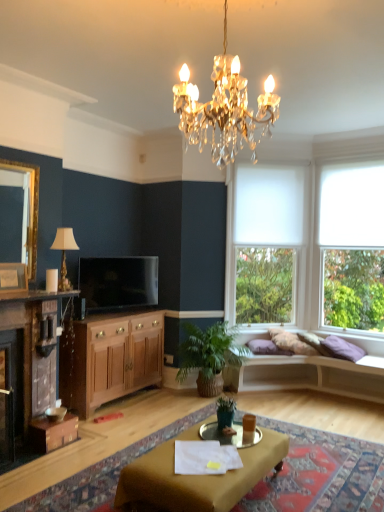
At what (x,y) coordinates should I click in order to perform the action: click on matte gold picture frame at left. Please return your answer as a coordinate pair (x, y). Image resolution: width=384 pixels, height=512 pixels. Looking at the image, I should click on (13, 278).

The image size is (384, 512). Describe the element at coordinates (268, 221) in the screenshot. I see `white roller blind at right, the 1th window positioned from the left` at that location.

From the picture: In order to face wooden cabinet at lower left, should I rotate leftwards or rightwards?

To face it directly, rotate left by 10.396 degrees.

What do you see at coordinates (112, 359) in the screenshot?
I see `wooden cabinet at lower left` at bounding box center [112, 359].

At what (x,y) coordinates should I click in order to perform the action: click on transparent glass window at right, placed as the first window when sorted from right to left. Please return your answer as a coordinate pair (x, y). Image resolution: width=384 pixels, height=512 pixels. Looking at the image, I should click on point(353,246).

Find the location of a particular element. The image size is (384, 512). matte gold picture frame at left is located at coordinates (13, 278).

Where is `window that is the 2nd one when counting rightward from the clear glass tray at center`? This screenshot has width=384, height=512. window that is the 2nd one when counting rightward from the clear glass tray at center is located at coordinates (353, 246).

Considering the positions of point (258, 434) and point (330, 207), is point (258, 434) closer or farther from the camera than point (330, 207)?

Point (258, 434) is positioned closer to the camera compared to point (330, 207).

Is clear glass tray at center facing away from transparent glass window at right, which is the second window in left-to-right order?

That's not correct — clear glass tray at center is not looking away from transparent glass window at right, which is the second window in left-to-right order.

Is clear glass tray at center with transparent glass window at right, which is the second window in left-to-right order?

No, clear glass tray at center is not with transparent glass window at right, which is the second window in left-to-right order.

In terms of height, does white roller blind at right, the 1th window positioned from the left, look taller or shorter compared to matte black mantel at left?

In the image, white roller blind at right, the 1th window positioned from the left, appears to be taller than matte black mantel at left.

Is white roller blind at right, the 1th window positioned from the left, positioned beyond the bounds of matte black mantel at left?

Yes, white roller blind at right, the 1th window positioned from the left, is located beyond the bounds of matte black mantel at left.

From a real-world perspective, which is physically below, white roller blind at right, the second window in the right-to-left sequence, or matte black mantel at left?

From a 3D spatial view, matte black mantel at left is below.

Can you confirm if white roller blind at right, the 1th window positioned from the left, is bigger than matte black mantel at left?

Correct, white roller blind at right, the 1th window positioned from the left, is larger in size than matte black mantel at left.

In the scene shown: Is matte gold picture frame at left spatially inside matte brown desk at center, or outside of it?

matte gold picture frame at left is spatially situated outside matte brown desk at center.

Does matte gold picture frame at left have a lesser height compared to matte brown desk at center?

No, matte gold picture frame at left is not shorter than matte brown desk at center.

Considering the positions of objects matte gold picture frame at left and matte brown desk at center in the image provided, who is behind, matte gold picture frame at left or matte brown desk at center?

matte gold picture frame at left.

From the image's perspective, is matte gold picture frame at left below matte brown desk at center?

No, from the image's perspective, matte gold picture frame at left is not beneath matte brown desk at center.

From the image's perspective, is matte gold picture frame at left located above green woven basket at lower center, which ranks as the second houseplant in front-to-back order?

Yes, from the image's perspective, matte gold picture frame at left is over green woven basket at lower center, which ranks as the second houseplant in front-to-back order.

Considering the sizes of objects matte gold picture frame at left and green woven basket at lower center, marked as the 1th houseplant in a back-to-front arrangement, in the image provided, who is shorter, matte gold picture frame at left or green woven basket at lower center, marked as the 1th houseplant in a back-to-front arrangement,?

matte gold picture frame at left.

Is matte gold picture frame at left positioned behind green woven basket at lower center, which ranks as the second houseplant in front-to-back order?

No, matte gold picture frame at left is closer to the camera.

The width and height of the screenshot is (384, 512). I want to click on pillow lying behind the green woven basket at lower center, marked as the 1th houseplant in a back-to-front arrangement, so click(342, 348).

From a real-world perspective, which object rests below the other?

In real-world perspective, green woven basket at lower center, marked as the 1th houseplant in a back-to-front arrangement, is lower.

Is purple velvet pillow at right aimed at green woven basket at lower center, which ranks as the second houseplant in front-to-back order?

No, purple velvet pillow at right is not oriented towards green woven basket at lower center, which ranks as the second houseplant in front-to-back order.

Which object is further away from the camera, purple velvet pillow at right or green woven basket at lower center, which ranks as the second houseplant in front-to-back order?

purple velvet pillow at right is further from the camera.

Considering the sizes of objects purple velvet pillow at right and matte brown desk at center in the image provided, who is bigger, purple velvet pillow at right or matte brown desk at center?

matte brown desk at center is bigger.

Considering the positions of objects purple velvet pillow at right and matte brown desk at center in the image provided, who is in front, purple velvet pillow at right or matte brown desk at center?

matte brown desk at center.

What's the angular difference between purple velvet pillow at right and matte brown desk at center's facing directions?

90.4 degrees separate the facing orientations of purple velvet pillow at right and matte brown desk at center.

Does point (40, 293) come behind point (255, 470)?

Yes, point (40, 293) is behind point (255, 470).

From a real-world perspective, who is located higher, matte black mantel at left or matte brown desk at center?

From a 3D spatial view, matte black mantel at left is above.

Consider the image. Can we say matte black mantel at left lies outside matte brown desk at center?

Yes, matte black mantel at left is located beyond the bounds of matte brown desk at center.

Is matte black mantel at left to the right of matte brown desk at center from the viewer's perspective?

Incorrect, matte black mantel at left is not on the right side of matte brown desk at center.

Identify the location of glass table lying below the transparent glass window at right, which is the second window in left-to-right order (from the image's perspective). The image size is (384, 512). (229, 435).

The image size is (384, 512). What are the coordinates of `the 1st window counting from the right side of the matte black mantel at left` in the screenshot? It's located at (268, 221).

Consider the image. Estimate the real-world distances between objects in this image. Which object is further from white wood studio couch at lower right, wooden cabinet at lower left or transparent glass window at right, placed as the first window when sorted from right to left?

Based on the image, transparent glass window at right, placed as the first window when sorted from right to left, appears to be further to white wood studio couch at lower right.

Estimate the real-world distances between objects in this image. Which object is closer to green woven basket at lower center, marked as the 1th houseplant in a back-to-front arrangement, gold-framed mirror at upper left or flat screen tv at center?

flat screen tv at center is positioned closer to the anchor green woven basket at lower center, marked as the 1th houseplant in a back-to-front arrangement.

Estimate the real-world distances between objects in this image. Which object is further from matte black mantel at left, matte brown desk at center or green woven basket at lower center, which ranks as the second houseplant in front-to-back order?

matte brown desk at center lies further to matte black mantel at left than the other object.

Which object lies nearer to the anchor point transparent glass window at right, placed as the first window when sorted from right to left, white wood studio couch at lower right or green matte plant at center, the second houseplant positioned from the back?

white wood studio couch at lower right.

From the image, which object appears to be farther from brown wood cabinet at left, purple velvet pillow at right or wooden cabinet at lower left?

purple velvet pillow at right lies further to brown wood cabinet at left than the other object.

From the picture: Looking at the image, which one is located closer to transparent glass window at right, which is the second window in left-to-right order, brown wood cabinet at left or clear glass tray at center?

clear glass tray at center is positioned closer to the anchor transparent glass window at right, which is the second window in left-to-right order.

Estimate the real-world distances between objects in this image. Which object is closer to flat screen tv at center, white roller blind at right, the second window in the right-to-left sequence, or matte black mantel at left?

matte black mantel at left is closer to flat screen tv at center.

From the picture: When comparing their distances from matte brown desk at center, does brown wood cabinet at left or white wood studio couch at lower right seem closer?

Among the two, brown wood cabinet at left is located nearer to matte brown desk at center.

The height and width of the screenshot is (512, 384). In order to click on glass table between flat screen tv at center and purple velvet pillow at right in this screenshot , I will do `click(229, 435)`.

Where is `studio couch between matte gold picture frame at left and purple velvet pillow at right`? studio couch between matte gold picture frame at left and purple velvet pillow at right is located at coordinates (309, 375).

Where is `glass table between matte gold picture frame at left and white wood studio couch at lower right from left to right`? The image size is (384, 512). glass table between matte gold picture frame at left and white wood studio couch at lower right from left to right is located at coordinates 229,435.

Identify the location of studio couch between clear glass tray at center and white roller blind at right, the second window in the right-to-left sequence, from front to back. tap(309, 375).